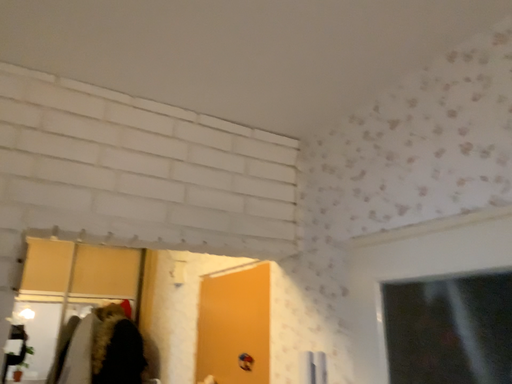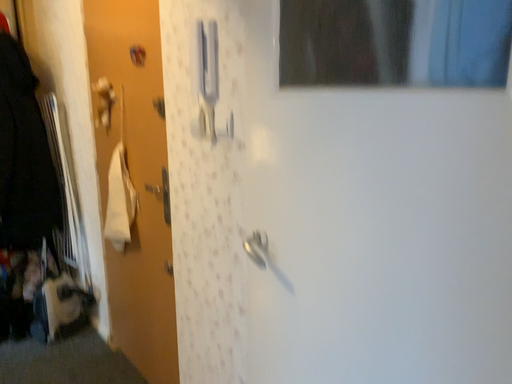
Question: Which way did the camera rotate in the video?

Choices:
 (A) rotated right
 (B) rotated left

Answer: (A)